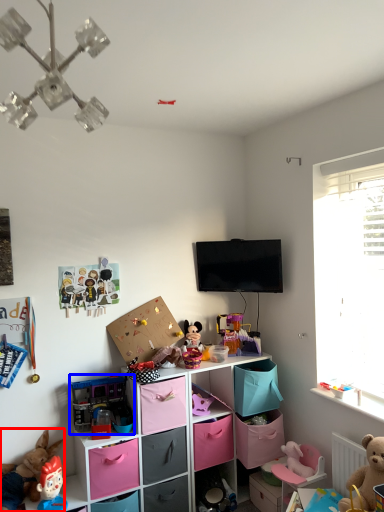
Question: Which object is closer to the camera taking this photo, toy (highlighted by a red box) or toy (highlighted by a blue box)?

Choices:
 (A) toy
 (B) toy

Answer: (A)